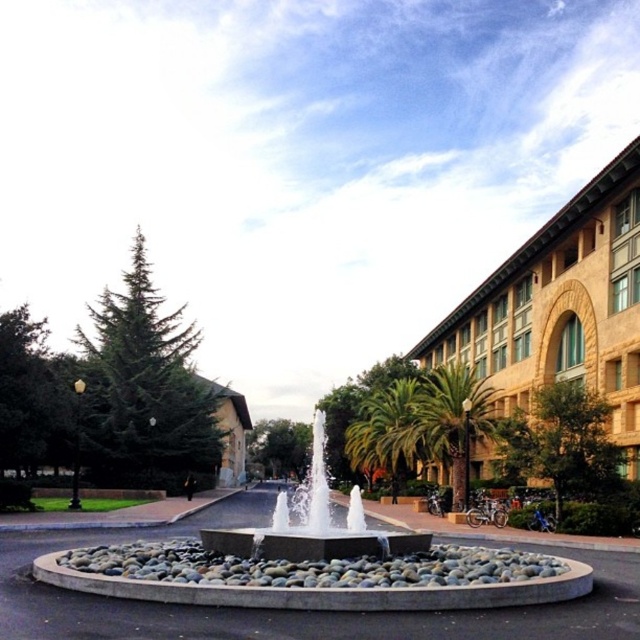
Between gray concrete fountain at center and green leafy palm tree at center-right, which one is positioned higher?

gray concrete fountain at center

Can you confirm if gray concrete fountain at center is smaller than green leafy palm tree at center-right?

Correct, gray concrete fountain at center occupies less space than green leafy palm tree at center-right.

What do you see at coordinates (317, 570) in the screenshot? Image resolution: width=640 pixels, height=640 pixels. I see `gray concrete fountain at center` at bounding box center [317, 570].

Where is `gray concrete fountain at center`? The image size is (640, 640). gray concrete fountain at center is located at coordinates (317, 570).

Is polished stone fountain at center taller than green leafy palm tree at center-right?

Yes.

Does polished stone fountain at center appear on the left side of green leafy palm tree at center-right?

Correct, you'll find polished stone fountain at center to the left of green leafy palm tree at center-right.

Where is `polished stone fountain at center`? Image resolution: width=640 pixels, height=640 pixels. polished stone fountain at center is located at coordinates (314, 525).

Which of these two, polished stone fountain at center or green leafy palm tree at center, stands shorter?

green leafy palm tree at center

Is point (364, 536) closer to camera compared to point (396, 492)?

Yes, point (364, 536) is closer to viewer.

The width and height of the screenshot is (640, 640). I want to click on polished stone fountain at center, so click(x=314, y=525).